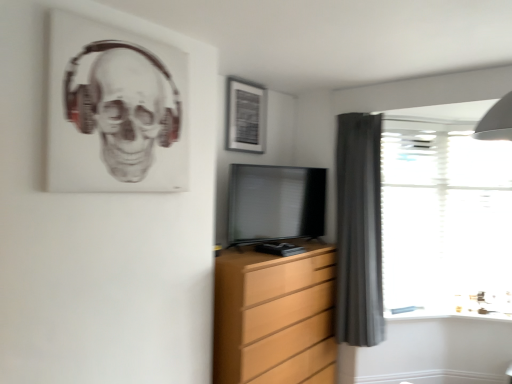
Describe the element at coordinates (445, 214) in the screenshot. I see `transparent plastic window at right` at that location.

This screenshot has width=512, height=384. What do you see at coordinates (275, 203) in the screenshot? I see `matte black tv at center` at bounding box center [275, 203].

This screenshot has height=384, width=512. I want to click on transparent glass door at right, so click(415, 217).

What do you see at coordinates (359, 230) in the screenshot? The image size is (512, 384). I see `dark gray fabric curtain at right` at bounding box center [359, 230].

The height and width of the screenshot is (384, 512). Find the location of `transparent plastic window at right`. transparent plastic window at right is located at coordinates (445, 214).

From the image's perspective, would you say dark gray fabric curtain at right is positioned over matte black tv at center?

Actually, dark gray fabric curtain at right appears below matte black tv at center in the image.

Looking at this image, is there a large distance between dark gray fabric curtain at right and matte black tv at center?

No, dark gray fabric curtain at right is not far away from matte black tv at center.

Considering the positions of objects dark gray fabric curtain at right and matte black tv at center in the image provided, who is behind, dark gray fabric curtain at right or matte black tv at center?

Positioned behind is dark gray fabric curtain at right.

Is wooden chest of drawers at center spatially inside matte black tv at center, or outside of it?

wooden chest of drawers at center is outside matte black tv at center.

Is wooden chest of drawers at center next to matte black tv at center and touching it?

wooden chest of drawers at center and matte black tv at center are clearly separated.

Measure the distance from wooden chest of drawers at center to matte black tv at center.

wooden chest of drawers at center is 21.14 inches from matte black tv at center.

From a real-world perspective, is wooden chest of drawers at center physically below matte black tv at center?

Yes.

Is matte black picture frame at upper center further to the viewer compared to wooden chest of drawers at center?

Yes, it is.

Is matte black picture frame at upper center taller than wooden chest of drawers at center?

Incorrect, the height of matte black picture frame at upper center is not larger of that of wooden chest of drawers at center.

How much distance is there between matte black picture frame at upper center and wooden chest of drawers at center?

The distance of matte black picture frame at upper center from wooden chest of drawers at center is 1.25 meters.

Does point (425, 294) come closer to viewer compared to point (310, 200)?

No.

From the image's perspective, is transparent glass door at right located above matte black tv at center?

No.

From a real-world perspective, is transparent glass door at right located beneath matte black tv at center?

Yes.

Is transparent glass door at right positioned with its back to matte black tv at center?

No, transparent glass door at right is not facing away from matte black tv at center.

Between matte black picture frame at upper center and matte black tv at center, which one has smaller size?

With smaller size is matte black picture frame at upper center.

Identify the location of picture frame on the left of the matte black tv at center. (246, 116).

Which is closer, (x=228, y=94) or (x=258, y=188)?

Point (x=228, y=94).

The width and height of the screenshot is (512, 384). Find the location of `curtain that is under the matte black tv at center (from a real-world perspective)`. curtain that is under the matte black tv at center (from a real-world perspective) is located at coordinates (359, 230).

From the image's perspective, between matte black tv at center and dark gray fabric curtain at right, which one is located above?

From the image's view, matte black tv at center is above.

Between matte black tv at center and dark gray fabric curtain at right, which one has larger width?

dark gray fabric curtain at right is wider.

Which object is positioned more to the left, matte black tv at center or dark gray fabric curtain at right?

Positioned to the left is matte black tv at center.

Considering the relative positions of matte black tv at center and wooden chest of drawers at center in the image provided, is matte black tv at center to the left of wooden chest of drawers at center from the viewer's perspective?

Incorrect, matte black tv at center is not on the left side of wooden chest of drawers at center.

From the image's perspective, is matte black tv at center located beneath wooden chest of drawers at center?

Incorrect, from the image's perspective, matte black tv at center is higher than wooden chest of drawers at center.

Which is nearer, (257, 212) or (330, 315)?

The point (257, 212) is closer.

Locate an element on the screen. The image size is (512, 384). curtain below the matte black tv at center (from the image's perspective) is located at coordinates (359, 230).

Locate an element on the screen. The image size is (512, 384). chest of drawers on the left of the matte black tv at center is located at coordinates (274, 316).

When comparing their distances from wooden chest of drawers at center, does matte black tv at center or matte black picture frame at upper center seem closer?

The object closer to wooden chest of drawers at center is matte black tv at center.

When comparing their distances from transparent glass door at right, does matte black tv at center or transparent plastic window at right seem closer?

Among the two, transparent plastic window at right is located nearer to transparent glass door at right.

When comparing their distances from transparent plastic window at right, does matte black tv at center or matte black picture frame at upper center seem closer?

matte black tv at center is positioned closer to the anchor transparent plastic window at right.

When comparing their distances from matte black picture frame at upper center, does transparent plastic window at right or dark gray fabric curtain at right seem further?

transparent plastic window at right is positioned further to the anchor matte black picture frame at upper center.

Looking at the image, which one is located closer to matte black picture frame at upper center, transparent plastic window at right or transparent glass door at right?

transparent glass door at right.

Which object lies nearer to the anchor point transparent glass door at right, transparent plastic window at right or wooden chest of drawers at center?

transparent plastic window at right lies closer to transparent glass door at right than the other object.

Looking at the image, which one is located closer to matte black tv at center, wooden chest of drawers at center or transparent glass door at right?

wooden chest of drawers at center.

Looking at the image, which one is located further to dark gray fabric curtain at right, transparent glass door at right or matte black picture frame at upper center?

matte black picture frame at upper center is positioned further to the anchor dark gray fabric curtain at right.

At what (x,y) coordinates should I click in order to perform the action: click on curtain between wooden chest of drawers at center and transparent plastic window at right. Please return your answer as a coordinate pair (x, y). Looking at the image, I should click on (359, 230).

In order to click on television between wooden chest of drawers at center and transparent glass door at right in the horizontal direction in this screenshot , I will do `click(275, 203)`.

Identify the location of glass door that lies between matte black picture frame at upper center and wooden chest of drawers at center from top to bottom. This screenshot has height=384, width=512. (415, 217).

You are a GUI agent. You are given a task and a screenshot of the screen. Output one action in this format:
    pyautogui.click(x=<x>, y=<y>)
    Task: Click on the television between wooden chest of drawers at center and transparent plastic window at right
    The height and width of the screenshot is (384, 512).
    Given the screenshot: What is the action you would take?
    pyautogui.click(x=275, y=203)